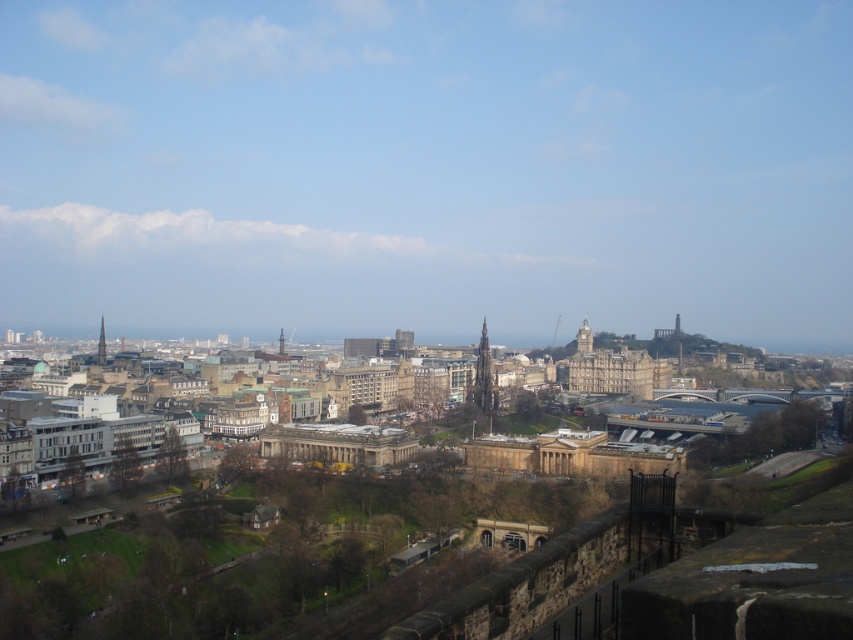
Question: Can you confirm if smooth stone clock tower at center is wider than smooth stone tower at center?

Choices:
 (A) no
 (B) yes

Answer: (A)

Question: Is smooth gray stone tower at center to the left of smooth stone clock tower at center from the viewer's perspective?

Choices:
 (A) no
 (B) yes

Answer: (B)

Question: Is smooth gray stone tower at center wider than smooth stone clock tower at center?

Choices:
 (A) no
 (B) yes

Answer: (B)

Question: Estimate the real-world distances between objects in this image. Which object is farther from the smooth stone tower at center?

Choices:
 (A) smooth gray stone tower at center
 (B) smooth stone clock tower at center

Answer: (B)

Question: Which point is closer to the camera?

Choices:
 (A) (579, 326)
 (B) (97, 355)
 (C) (482, 378)

Answer: (C)

Question: Based on their relative distances, which object is farther from the smooth gray stone tower at center?

Choices:
 (A) smooth stone clock tower at center
 (B) smooth stone tower at center

Answer: (B)